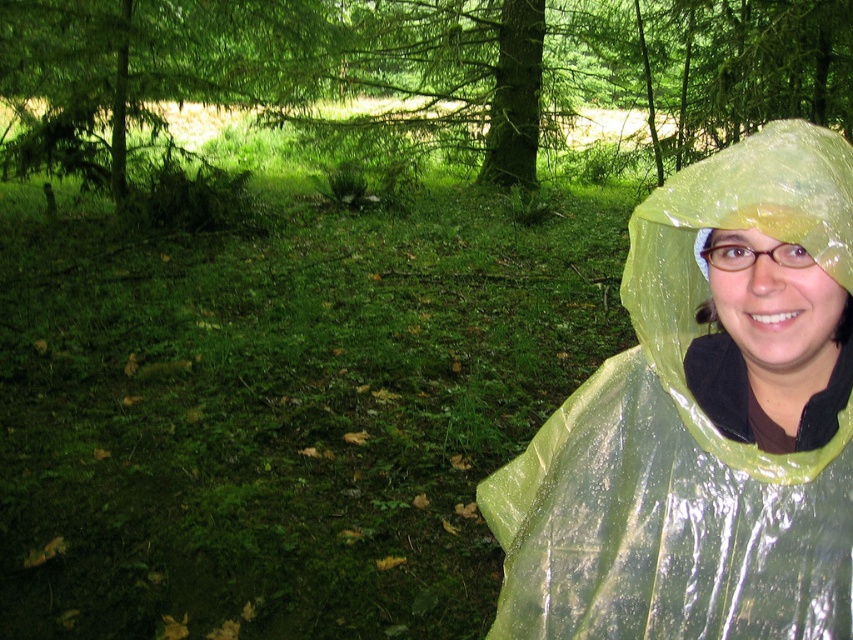
You are navigating through a forest and see two points marked in the image. Which point is closer to you, point [643,545] or point [532,129]?

Point [643,545] is in front of point [532,129], so it is closer to you.

You are a photographer trying to capture a clear shot of the green glossy tree at center. However, the transparent yellow raincoat at right is blocking your view. Can you move the raincoat to the right to get a better shot?

The transparent yellow raincoat at right is already positioned on the left side of the green glossy tree at center. Moving it further to the right would place it away from the tree, potentially clearing the view for a better shot.

You are a photographer trying to capture the green glossy tree at center in your shot. You notice the transparent yellow raincoat at right is blocking part of the tree. Can you move the raincoat to get a clear view of the tree?

The transparent yellow raincoat at right is closer to the viewer than the green glossy tree at center, so moving it would allow you to see the tree clearly without obstruction.